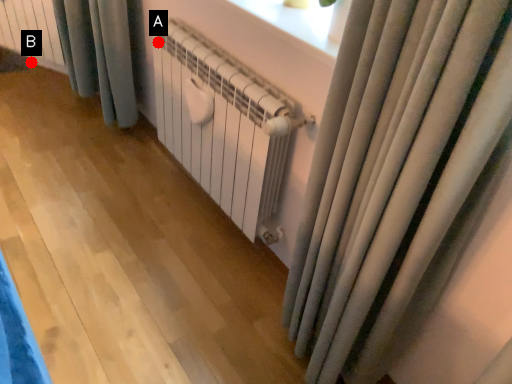
Question: Two points are circled on the image, labeled by A and B beside each circle. Which point appears closest to the camera in this image?

Choices:
 (A) A is closer
 (B) B is closer

Answer: (A)